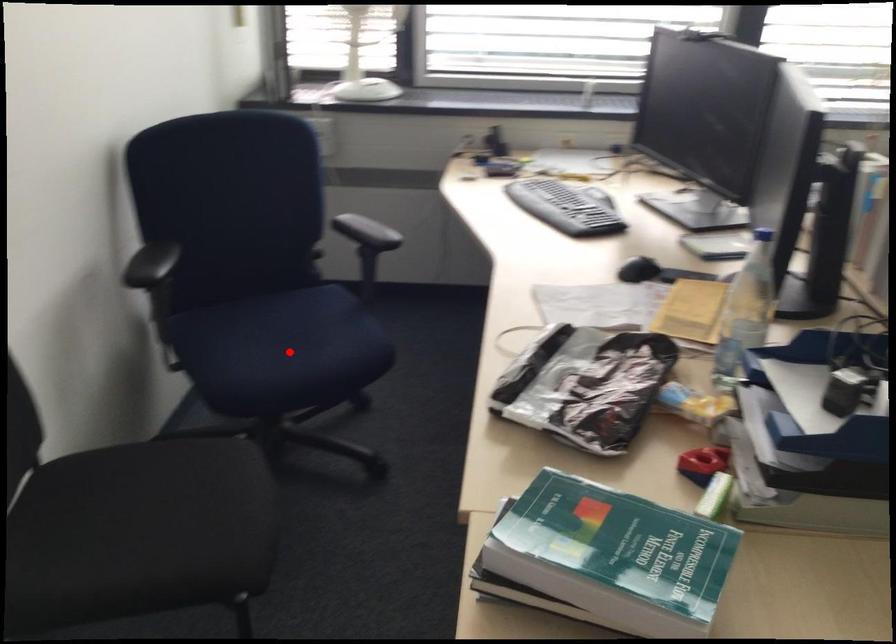
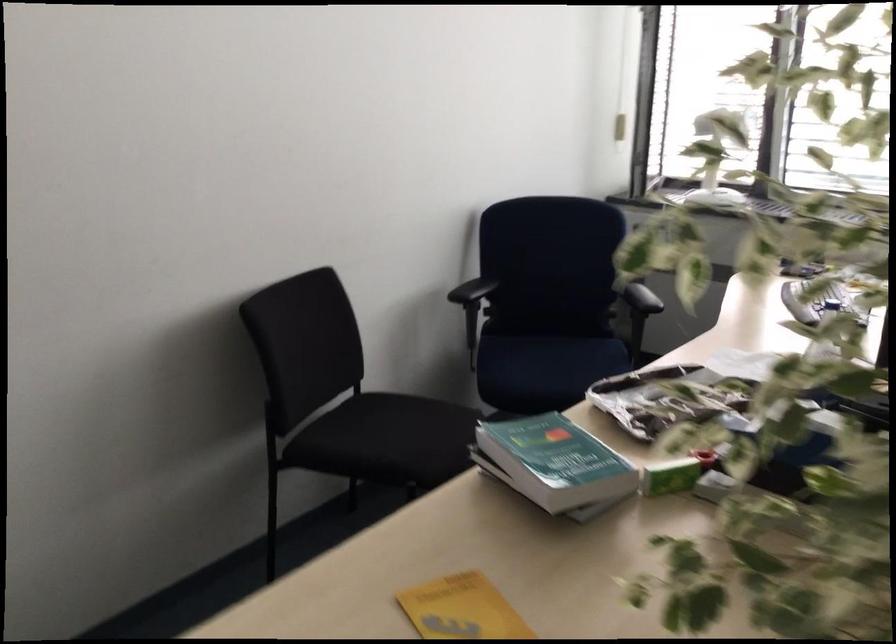
Question: I am providing you with two images of the same scene from different viewpoints. Image1 has a red point marked. In image2, the corresponding 3D location appears at what relative position? Reply with the corresponding letter.

Choices:
 (A) Closer
 (B) Farther

Answer: (B)